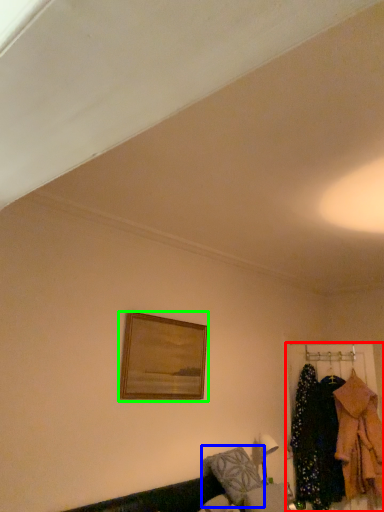
Question: Considering the real-world distances, which object is closest to closet (highlighted by a red box)? pillow (highlighted by a blue box) or picture frame (highlighted by a green box).

Choices:
 (A) pillow
 (B) picture frame

Answer: (A)